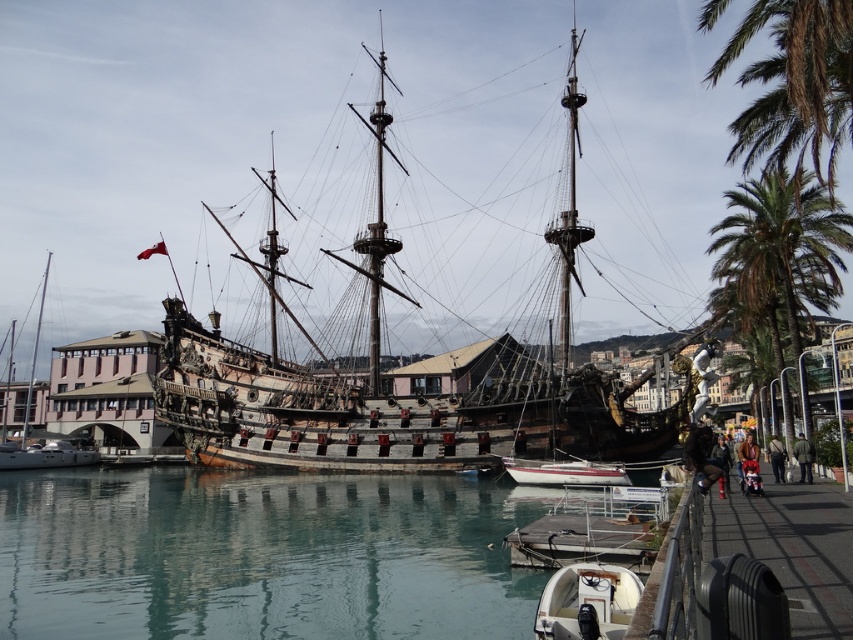
Question: Does wooden ship at center appear under white glossy sailboat at left?

Choices:
 (A) no
 (B) yes

Answer: (A)

Question: Is white glossy sailboat at lower center to the left of white glossy sailboat at left from the viewer's perspective?

Choices:
 (A) yes
 (B) no

Answer: (B)

Question: Is white glossy boat at lower center to the left of smooth wood mast at left from the viewer's perspective?

Choices:
 (A) yes
 (B) no

Answer: (B)

Question: Which object is positioned farthest from the clear water at center?

Choices:
 (A) white glossy boat at lower center
 (B) wooden ship at center
 (C) white glossy sailboat at left
 (D) smooth wood mast at left

Answer: (D)

Question: Which of the following is the closest to the observer?

Choices:
 (A) click(25, 406)
 (B) click(503, 380)
 (C) click(41, 292)

Answer: (B)

Question: Which point is farther from the camera taking this photo?

Choices:
 (A) (202, 528)
 (B) (68, 451)
 (C) (26, 413)
 (D) (631, 595)

Answer: (C)